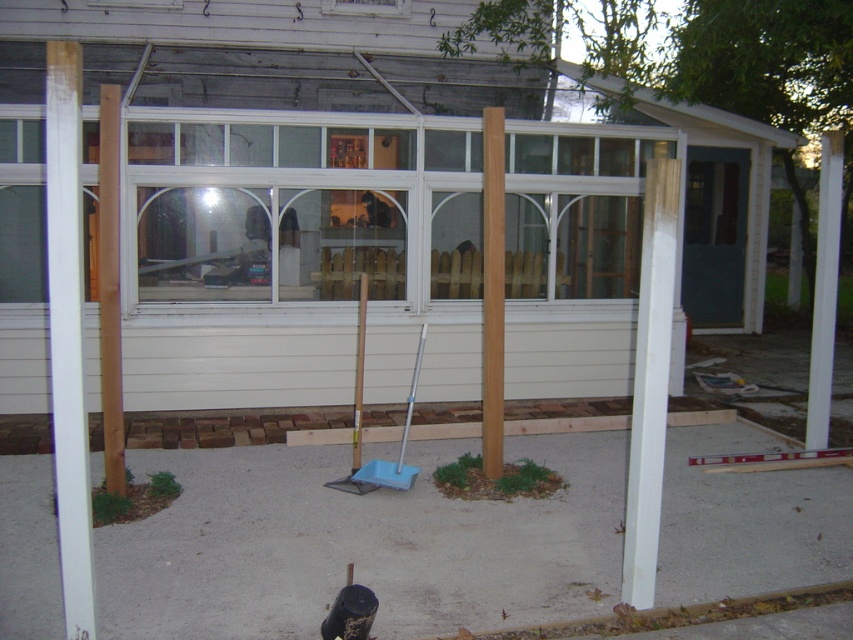
Question: Which point is closer to the camera taking this photo?

Choices:
 (A) (354, 436)
 (B) (740, 161)
 (C) (405, 477)
 (D) (485, 225)

Answer: (D)

Question: Is light brown wood pole at center wider than wooden handle shovel at center?

Choices:
 (A) no
 (B) yes

Answer: (B)

Question: Can you confirm if light brown wood pole at left is thinner than wooden handle shovel at center?

Choices:
 (A) no
 (B) yes

Answer: (A)

Question: Which point appears closest to the camera in this image?

Choices:
 (A) (483, 384)
 (B) (357, 492)
 (C) (119, 116)
 (D) (381, 484)

Answer: (C)

Question: Is the position of green matte screen door at right less distant than that of light brown wood pole at left?

Choices:
 (A) yes
 (B) no

Answer: (B)

Question: Considering the real-world distances, which object is closest to the light brown wood pole at left?

Choices:
 (A) green matte screen door at right
 (B) light brown wood pole at center

Answer: (B)